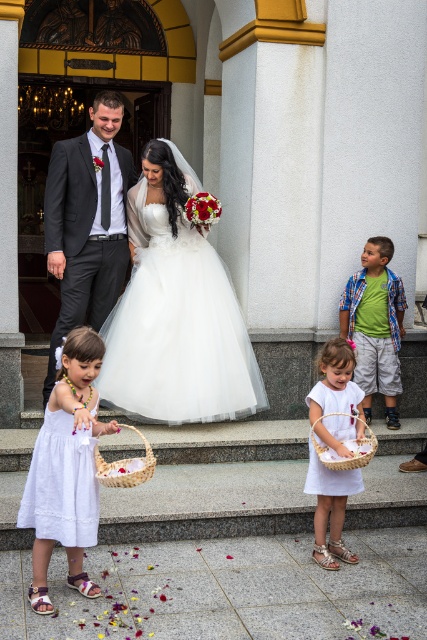
You are a photographer standing at the entrance of the church. You want to take a photo of the bride and groom exiting the church. There is a point at coordinate (66, 468) in the image. What object is this point located on?

The point at coordinate (66, 468) is located on the white cotton dress at lower left.

You are a photographer standing at the back of the church steps. You want to take a photo of the white satin dress at center and the white woven basket at lower center so that both are in focus. The camera you are using has a depth of field that can cover 5 feet. Will you be able to capture both objects clearly in the same photo?

The distance between the white satin dress at center and the white woven basket at lower center is 5.63 feet. Since the camera can only cover 5 feet, the objects are slightly too far apart for both to be in focus simultaneously. Adjust your position or settings to ensure both are within the depth of field.